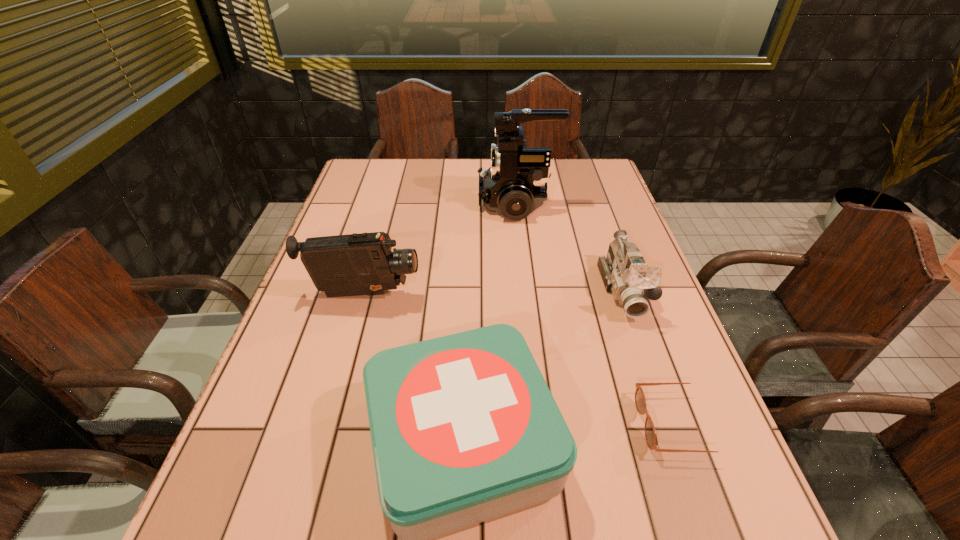
The height and width of the screenshot is (540, 960). In order to click on blank space that satisfies the following two spatial constraints: 1. on the front-facing side of the shortest camcorder; 2. on the front-facing side of the leftmost camcorder in this screenshot , I will do `click(625, 294)`.